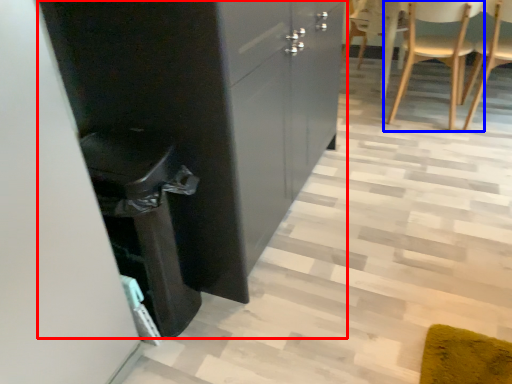
Question: Which point is further to the camera, cabinetry (highlighted by a red box) or chair (highlighted by a blue box)?

Choices:
 (A) cabinetry
 (B) chair

Answer: (B)